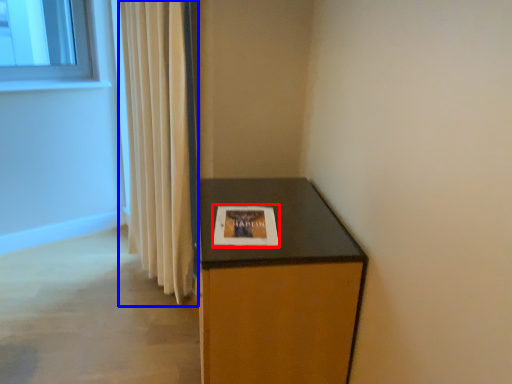
Question: Which object is closer to the camera taking this photo, picture frame (highlighted by a red box) or curtain (highlighted by a blue box)?

Choices:
 (A) picture frame
 (B) curtain

Answer: (A)